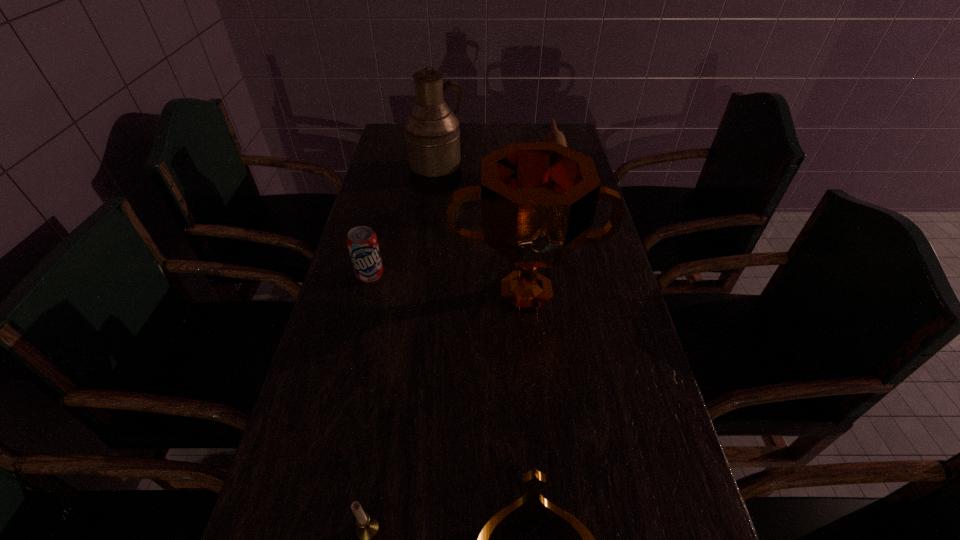
Where is `award`? This screenshot has width=960, height=540. award is located at coordinates [538, 199].

Where is `pitcher`? This screenshot has width=960, height=540. pitcher is located at coordinates (432, 134).

The height and width of the screenshot is (540, 960). Identify the location of the fourth shortest object. (554, 135).

Find the location of a particular element. the leftmost object is located at coordinates (362, 243).

Find the location of a particular element. free space located 0.330m on the side of the award with the star emblem is located at coordinates (544, 474).

The image size is (960, 540). What are the coordinates of `vacant space located on the back of the pitcher` in the screenshot? It's located at tap(442, 130).

Locate an element on the screen. This screenshot has height=540, width=960. vacant region located 0.140m on the left side of the third tallest object is located at coordinates (497, 184).

Image resolution: width=960 pixels, height=540 pixels. Find the location of `vacant space located on the left side of the third tallest object`. vacant space located on the left side of the third tallest object is located at coordinates (524, 184).

Locate an element on the screen. free spot located 0.260m on the left side of the third tallest object is located at coordinates click(x=462, y=184).

This screenshot has width=960, height=540. In order to click on vacant area situated on the front of the leftmost object in this screenshot , I will do `click(344, 382)`.